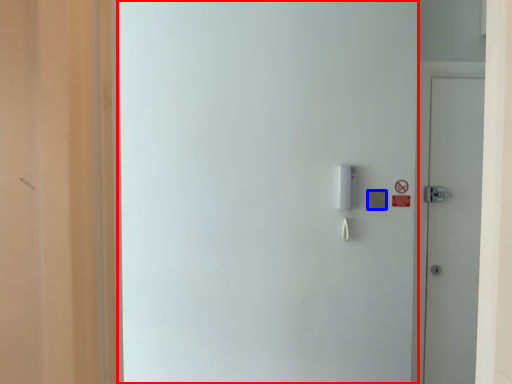
Question: Which object appears farthest to the camera in this image, screen door (highlighted by a red box) or light switch (highlighted by a blue box)?

Choices:
 (A) screen door
 (B) light switch

Answer: (B)